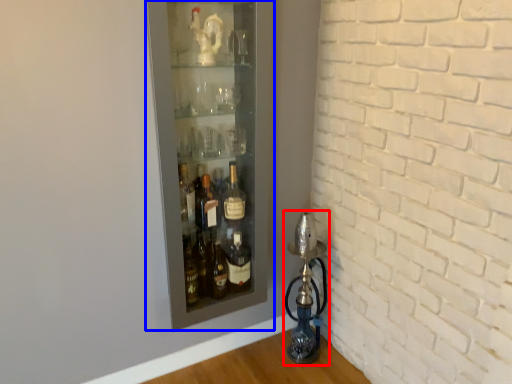
Question: Which of the following is the farthest to the observer, oil lamp (highlighted by a red box) or shelf (highlighted by a blue box)?

Choices:
 (A) oil lamp
 (B) shelf

Answer: (A)